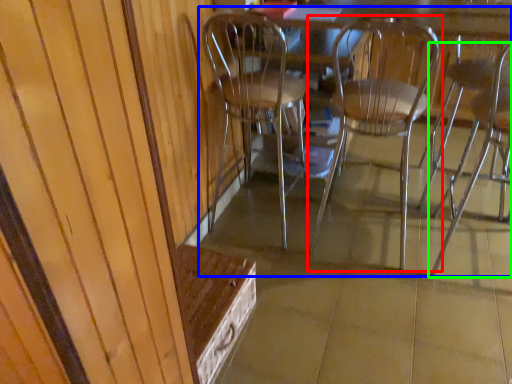
Question: Which object is positioned closest to chair (highlighted by a red box)? Select from chair (highlighted by a blue box) and chair (highlighted by a green box).

Choices:
 (A) chair
 (B) chair

Answer: (A)